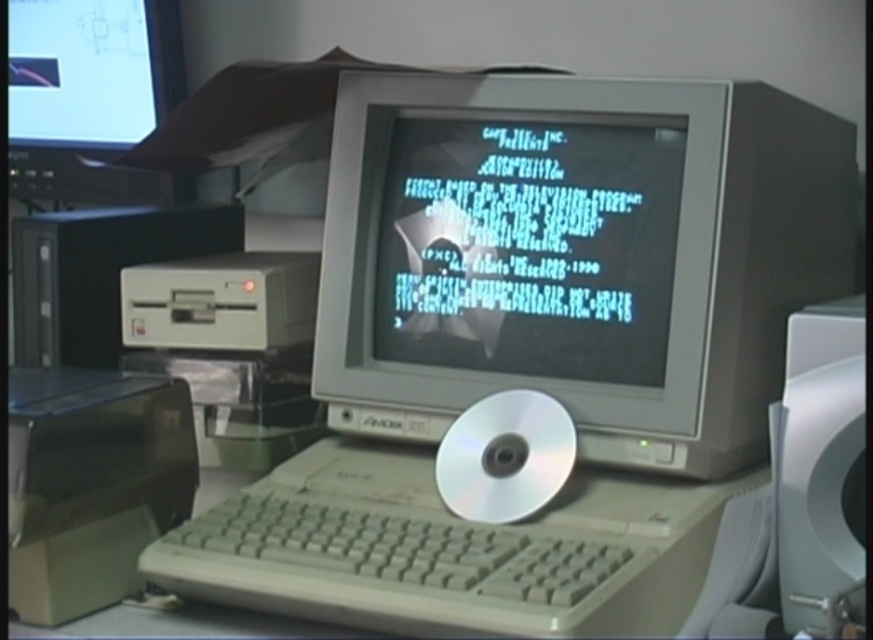
Is matte plastic monitor at center in front of white plastic keyboard at center?

No, it is behind white plastic keyboard at center.

Where is `matte plastic monitor at center`? This screenshot has height=640, width=873. matte plastic monitor at center is located at coordinates tap(528, 248).

Where is `matte plastic monitor at center`? matte plastic monitor at center is located at coordinates (528, 248).

Can you confirm if white plastic keyboard at center is positioned to the left of white plastic speaker at right?

Indeed, white plastic keyboard at center is positioned on the left side of white plastic speaker at right.

Which is behind, point (606, 632) or point (788, 486)?

The point (788, 486) is more distant.

In order to click on white plastic keyboard at center in this screenshot , I will do `click(390, 564)`.

Can you confirm if matte plastic monitor at center is positioned to the left of white plastic speaker at right?

Correct, you'll find matte plastic monitor at center to the left of white plastic speaker at right.

Who is shorter, matte plastic monitor at center or white plastic speaker at right?

white plastic speaker at right is shorter.

This screenshot has height=640, width=873. Find the location of `matte plastic monitor at center`. matte plastic monitor at center is located at coordinates (528, 248).

The image size is (873, 640). What are the coordinates of `matte plastic monitor at center` in the screenshot? It's located at (528, 248).